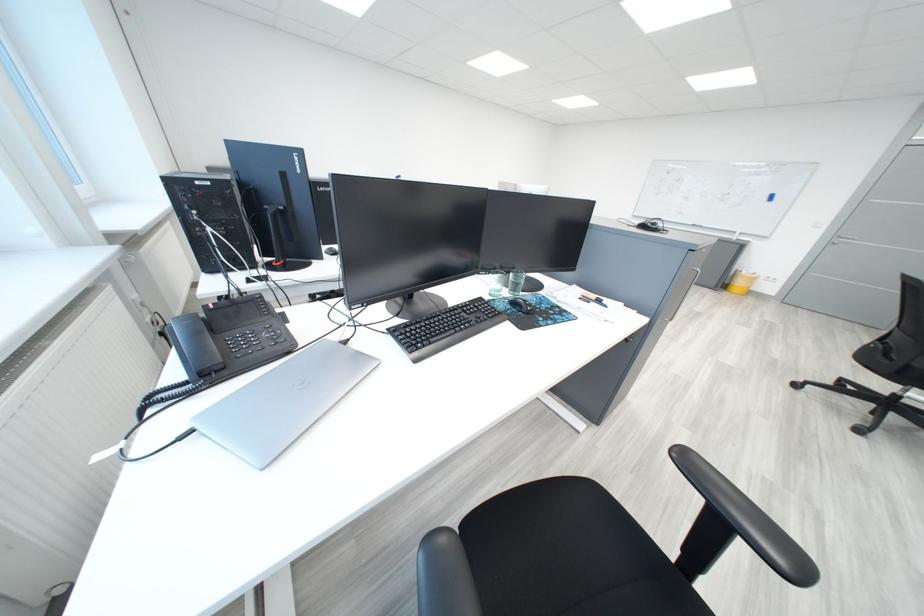
I want to click on black computer mouse, so click(521, 305).